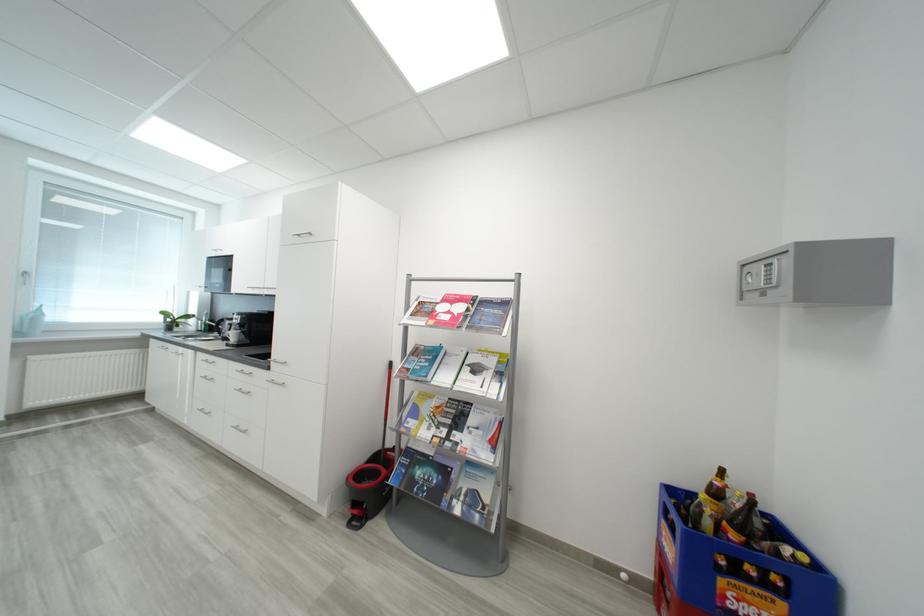
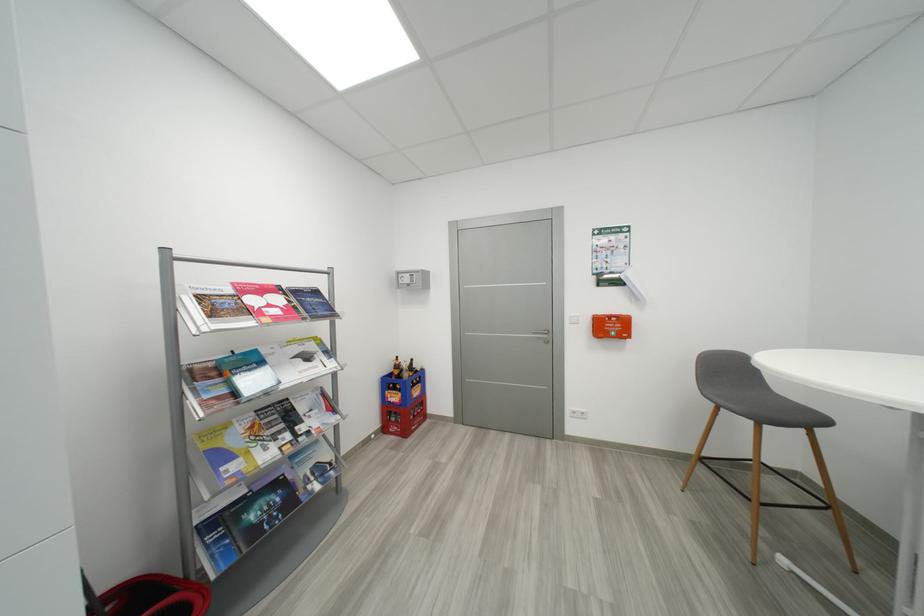
Locate, in the second image, the point that corresponds to (x=723, y=493) in the first image.

(404, 369)